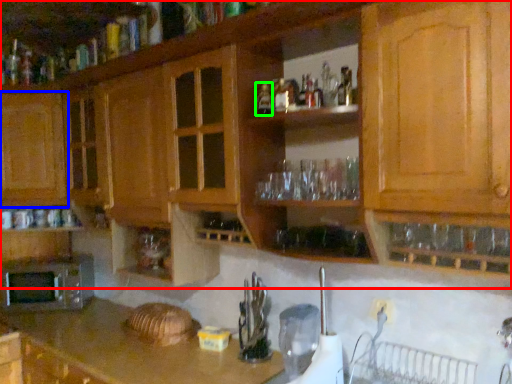
Question: Estimate the real-world distances between objects in this image. Which object is farther from cabinetry (highlighted by a red box), cabinetry (highlighted by a blue box) or bottle (highlighted by a green box)?

Choices:
 (A) cabinetry
 (B) bottle

Answer: (B)